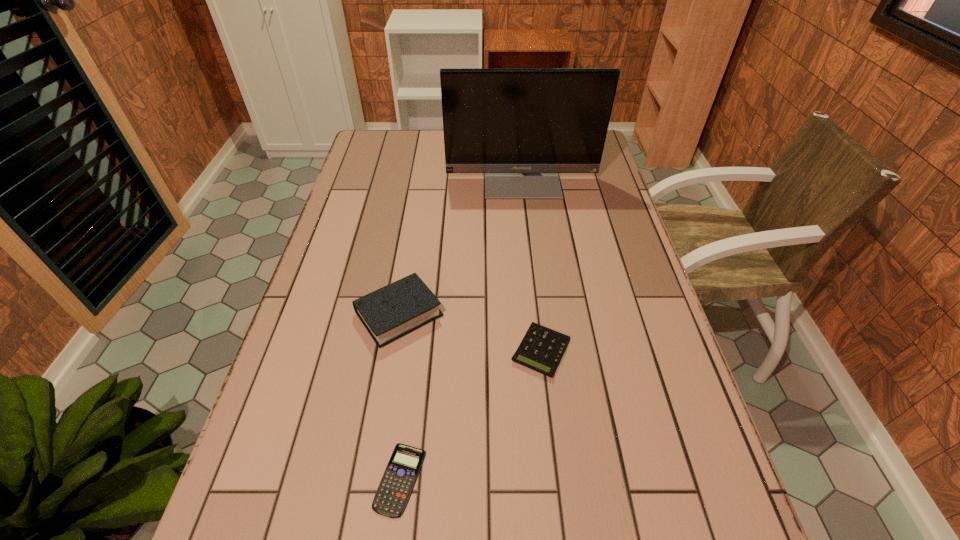
You are a GUI agent. You are given a task and a screenshot of the screen. Output one action in this format:
    pyautogui.click(x=<x>, y=<y>)
    Task: Click on the vacant space that satisfies the following two spatial constraints: 1. on the back side of the left calculator; 2. on the right side of the farther calculator
    This screenshot has height=540, width=960.
    Given the screenshot: What is the action you would take?
    pyautogui.click(x=416, y=350)